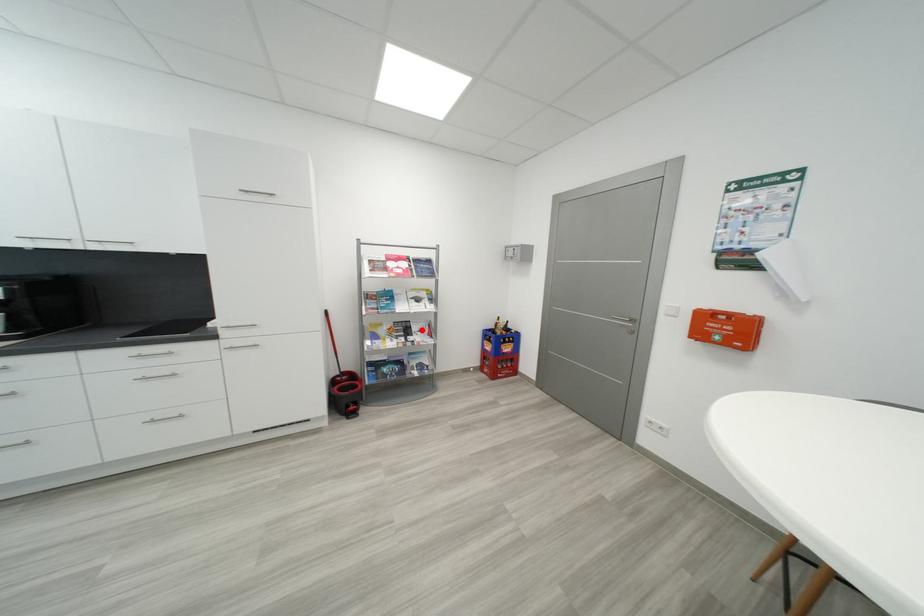
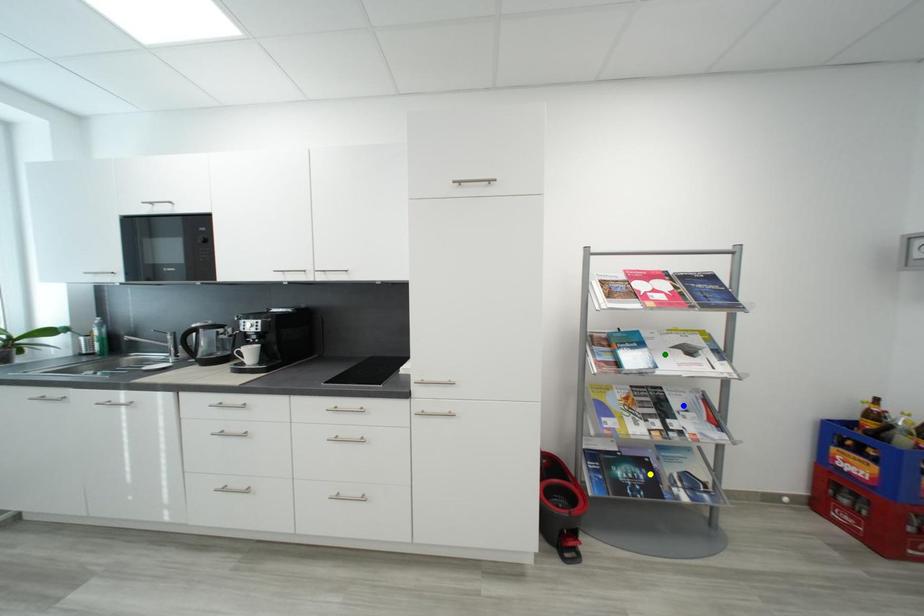
Question: I am providing you with two images of the same scene from different viewpoints. A red point is marked on the first image. You are given multiple points on the second image. Which mark in image 2 goes with the point in image 1?

Choices:
 (A) green point
 (B) blue point
 (C) yellow point

Answer: (B)